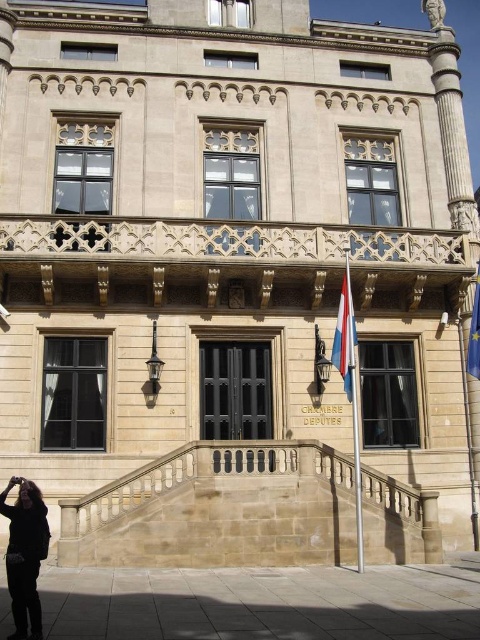
Who is higher up, beige stone balustrade at center or polished fabric flag at center?

Positioned higher is polished fabric flag at center.

Is point (236, 522) behind point (336, 349)?

That is False.

This screenshot has height=640, width=480. I want to click on beige stone balustrade at center, so click(218, 508).

Can you confirm if stone balustrade at center is shorter than polished fabric flag at center?

Correct, stone balustrade at center is not as tall as polished fabric flag at center.

Which is below, stone balustrade at center or polished fabric flag at center?

polished fabric flag at center is below.

The height and width of the screenshot is (640, 480). Find the location of `stone balustrade at center`. stone balustrade at center is located at coordinates (226, 262).

Looking at this image, who is lower down, beige stone balustrade at center or blue fabric flag at right?

beige stone balustrade at center

Who is more distant from viewer, (87, 508) or (474, 314)?

The point (474, 314) is more distant.

Where is `beige stone balustrade at center`? This screenshot has height=640, width=480. beige stone balustrade at center is located at coordinates click(x=218, y=508).